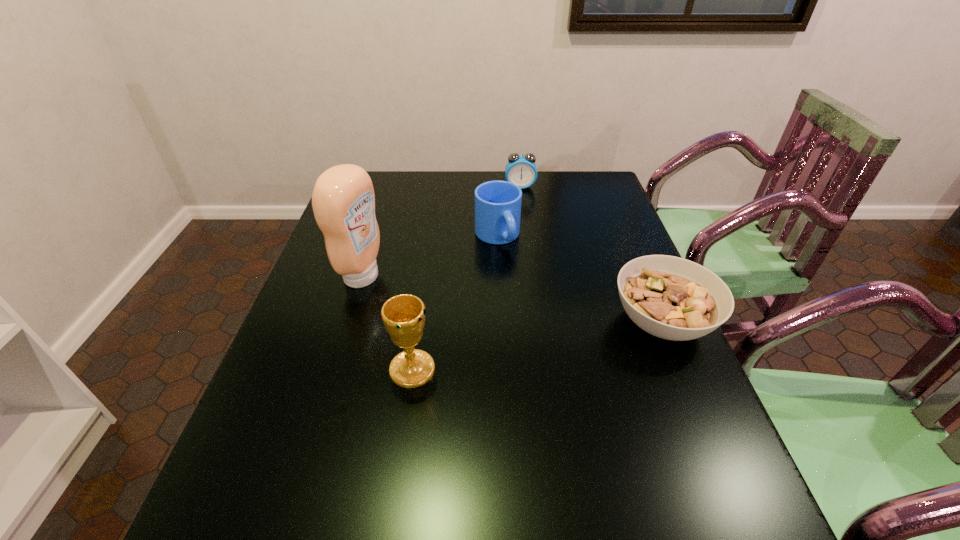
Locate an element on the screen. The image size is (960, 540). free region located 0.340m on the label of the condiment is located at coordinates (498, 321).

Where is `vacant space located on the label of the condiment`? Image resolution: width=960 pixels, height=540 pixels. vacant space located on the label of the condiment is located at coordinates (420, 297).

Image resolution: width=960 pixels, height=540 pixels. In order to click on free space located on the face of the farthest object in this screenshot , I will do click(x=522, y=211).

Where is `vacant space located on the face of the farthest object`? The width and height of the screenshot is (960, 540). vacant space located on the face of the farthest object is located at coordinates (526, 257).

Locate an element on the screen. vacant region located on the face of the farthest object is located at coordinates (526, 257).

Where is `blank space located 0.260m on the side of the mug with the handle`? The image size is (960, 540). blank space located 0.260m on the side of the mug with the handle is located at coordinates (547, 313).

Locate an element on the screen. Image resolution: width=960 pixels, height=540 pixels. vacant region located 0.310m on the side of the mug with the handle is located at coordinates (557, 327).

Locate an element on the screen. The width and height of the screenshot is (960, 540). free space located 0.280m on the side of the mug with the handle is located at coordinates (551, 319).

Find the location of `object that is at the far edge`. object that is at the far edge is located at coordinates (521, 170).

Image resolution: width=960 pixels, height=540 pixels. In order to click on object at the left edge in this screenshot , I will do `click(343, 200)`.